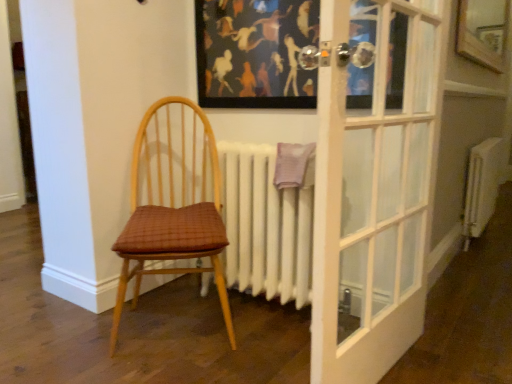
Where is `vacant area in front of wooden chair with woven seat cushion at left`? Image resolution: width=512 pixels, height=384 pixels. vacant area in front of wooden chair with woven seat cushion at left is located at coordinates (159, 370).